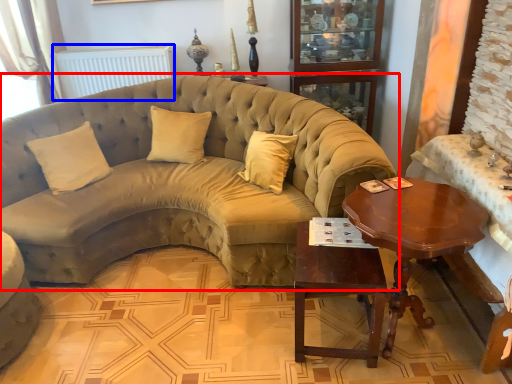
Question: Among these objects, which one is farthest to the camera, studio couch (highlighted by a red box) or radiator (highlighted by a blue box)?

Choices:
 (A) studio couch
 (B) radiator

Answer: (B)